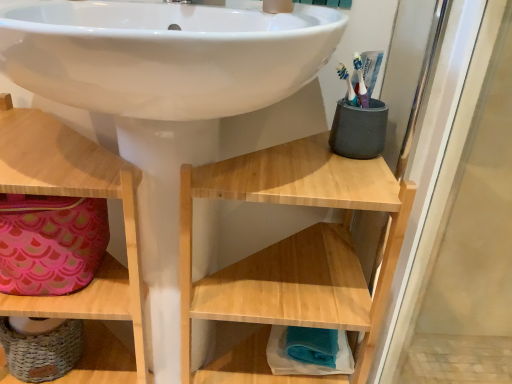
Question: Can you confirm if pink fabric bag at lower left is positioned to the right of teal fabric towel at lower center, the third shelf positioned from the left?

Choices:
 (A) no
 (B) yes

Answer: (A)

Question: Is pink fabric bag at lower left wider than teal fabric towel at lower center, which is the 1th shelf in right-to-left order?

Choices:
 (A) no
 (B) yes

Answer: (A)

Question: Can you confirm if pink fabric bag at lower left is thinner than teal fabric towel at lower center, which is the 1th shelf in right-to-left order?

Choices:
 (A) no
 (B) yes

Answer: (A)

Question: Is pink fabric bag at lower left completely or partially outside of teal fabric towel at lower center, which is the 1th shelf in right-to-left order?

Choices:
 (A) no
 (B) yes

Answer: (B)

Question: From the image's perspective, is pink fabric bag at lower left under teal fabric towel at lower center, which is the 1th shelf in right-to-left order?

Choices:
 (A) no
 (B) yes

Answer: (A)

Question: Considering the positions of wooden shelf at lower left, marked as the 1th shelf in a left-to-right arrangement, and pink fabric bag at lower left in the image, is wooden shelf at lower left, marked as the 1th shelf in a left-to-right arrangement, wider or thinner than pink fabric bag at lower left?

Choices:
 (A) thin
 (B) wide

Answer: (B)

Question: Would you say wooden shelf at lower left, the third shelf when ordered from right to left, is to the left or to the right of pink fabric bag at lower left in the picture?

Choices:
 (A) left
 (B) right

Answer: (B)

Question: In the image, is wooden shelf at lower left, the third shelf when ordered from right to left, positioned in front of or behind pink fabric bag at lower left?

Choices:
 (A) front
 (B) behind

Answer: (A)

Question: Considering the positions of point (69, 301) and point (80, 253), is point (69, 301) closer or farther from the camera than point (80, 253)?

Choices:
 (A) closer
 (B) farther

Answer: (A)

Question: In the image, is natural wood shelf at center, positioned as the 2th shelf in left-to-right order, on the left side or the right side of white glossy sink at center?

Choices:
 (A) right
 (B) left

Answer: (A)

Question: In terms of height, does natural wood shelf at center, positioned as the 2th shelf in left-to-right order, look taller or shorter compared to white glossy sink at center?

Choices:
 (A) short
 (B) tall

Answer: (A)

Question: From a real-world perspective, relative to white glossy sink at center, is natural wood shelf at center, which ranks as the 2th shelf in right-to-left order, vertically above or below?

Choices:
 (A) above
 (B) below

Answer: (B)

Question: Relative to white glossy sink at center, is natural wood shelf at center, which ranks as the 2th shelf in right-to-left order, in front or behind?

Choices:
 (A) behind
 (B) front

Answer: (A)

Question: Looking at the image, does natural wood shelf at center, which ranks as the 2th shelf in right-to-left order, seem bigger or smaller compared to pink fabric bag at lower left?

Choices:
 (A) small
 (B) big

Answer: (B)

Question: Is natural wood shelf at center, which ranks as the 2th shelf in right-to-left order, inside or outside of pink fabric bag at lower left?

Choices:
 (A) inside
 (B) outside

Answer: (B)